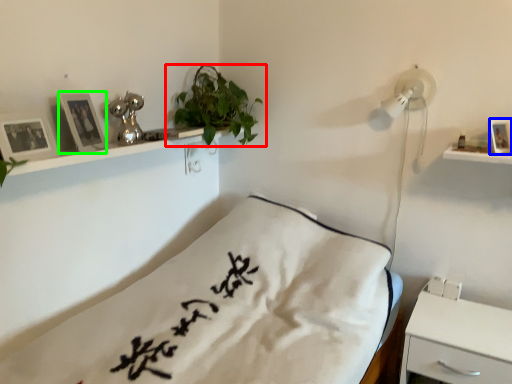
Question: Estimate the real-world distances between objects in this image. Which object is farther from houseplant (highlighted by a red box), picture frame (highlighted by a blue box) or picture frame (highlighted by a green box)?

Choices:
 (A) picture frame
 (B) picture frame

Answer: (A)